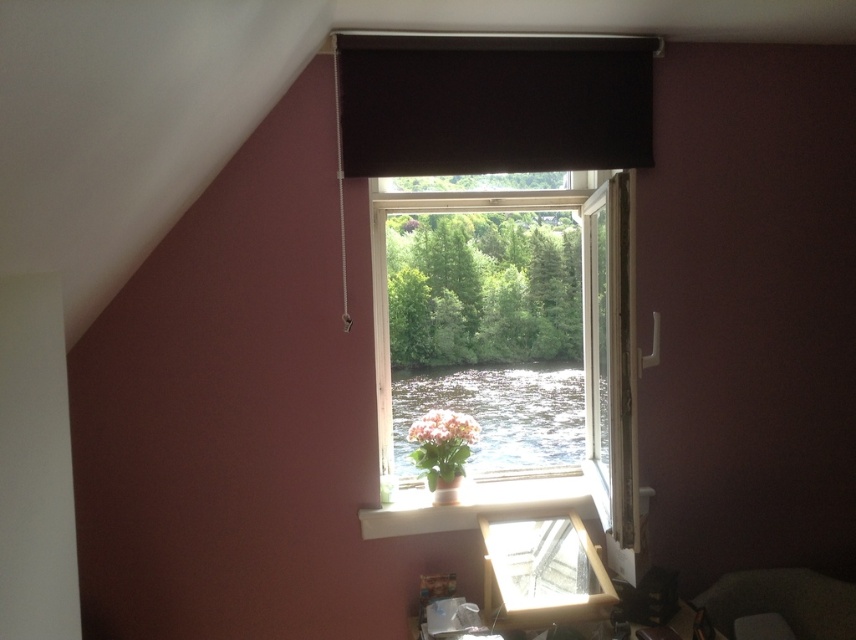
Question: Among these objects, which one is farthest from the camera?

Choices:
 (A) dark matte curtain at upper center
 (B) matte white vase at center
 (C) transparent glass window at center
 (D) matte pink flower at center

Answer: (D)

Question: Which point appears farthest from the camera in this image?

Choices:
 (A) (539, 330)
 (B) (492, 76)
 (C) (461, 458)

Answer: (A)

Question: Does dark matte curtain at upper center have a smaller size compared to matte pink flower at center?

Choices:
 (A) yes
 (B) no

Answer: (B)

Question: Among these objects, which one is nearest to the camera?

Choices:
 (A) matte pink flower at center
 (B) dark matte curtain at upper center
 (C) transparent glass window at center
 (D) matte white vase at center

Answer: (C)

Question: Is transparent glass window at center closer to camera compared to dark matte curtain at upper center?

Choices:
 (A) yes
 (B) no

Answer: (A)

Question: Can you confirm if transparent glass window at center is positioned to the left of matte white vase at center?

Choices:
 (A) yes
 (B) no

Answer: (B)